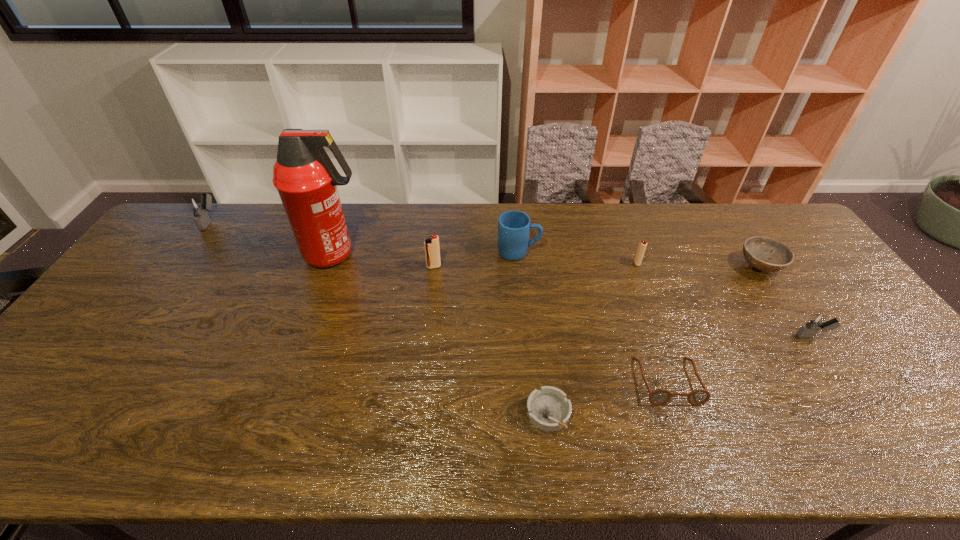
Identify the location of fire extinguisher. This screenshot has width=960, height=540. (306, 179).

At what (x,y) coordinates should I click in order to perform the action: click on the eighth object from right to left. Please return your answer as a coordinate pair (x, y). Looking at the image, I should click on (306, 179).

You are a GUI agent. You are given a task and a screenshot of the screen. Output one action in this format:
    pyautogui.click(x=<x>, y=<y>)
    Task: Click on the blue mug
    This screenshot has width=960, height=540.
    Given the screenshot: What is the action you would take?
    pyautogui.click(x=514, y=226)

At what (x,y) coordinates should I click in order to perform the action: click on the leftmost object. Please return your answer as a coordinate pair (x, y). Looking at the image, I should click on (199, 206).

Where is `the farthest igniter`? The width and height of the screenshot is (960, 540). the farthest igniter is located at coordinates (199, 206).

Find the location of a particular element. This screenshot has height=540, width=960. the left red igniter is located at coordinates (432, 250).

The height and width of the screenshot is (540, 960). Identify the location of the bigger red igniter. (432, 250).

Where is `the third igniter from left to right`? The width and height of the screenshot is (960, 540). the third igniter from left to right is located at coordinates (642, 245).

Where is `the smaller red igniter`? Image resolution: width=960 pixels, height=540 pixels. the smaller red igniter is located at coordinates tap(642, 245).

Locate an element on the screen. The width and height of the screenshot is (960, 540). the rightmost igniter is located at coordinates (817, 321).